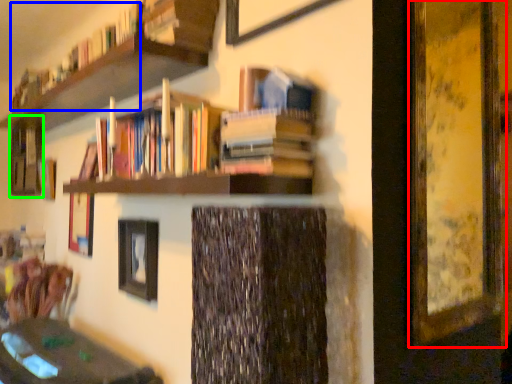
Question: Which object is the farthest from picture frame (highlighted by a red box)? Choose among these: book (highlighted by a blue box) or shelf (highlighted by a green box).

Choices:
 (A) book
 (B) shelf

Answer: (B)